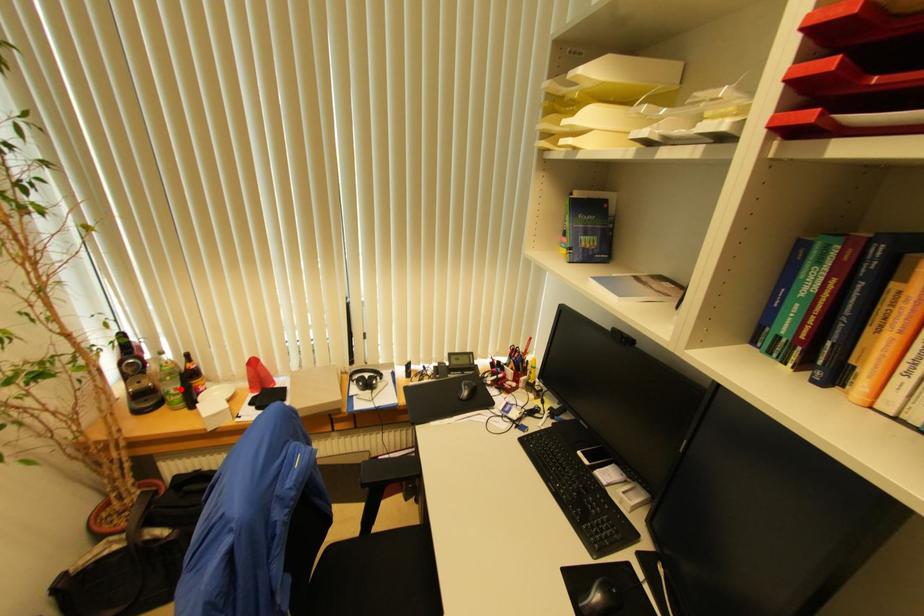
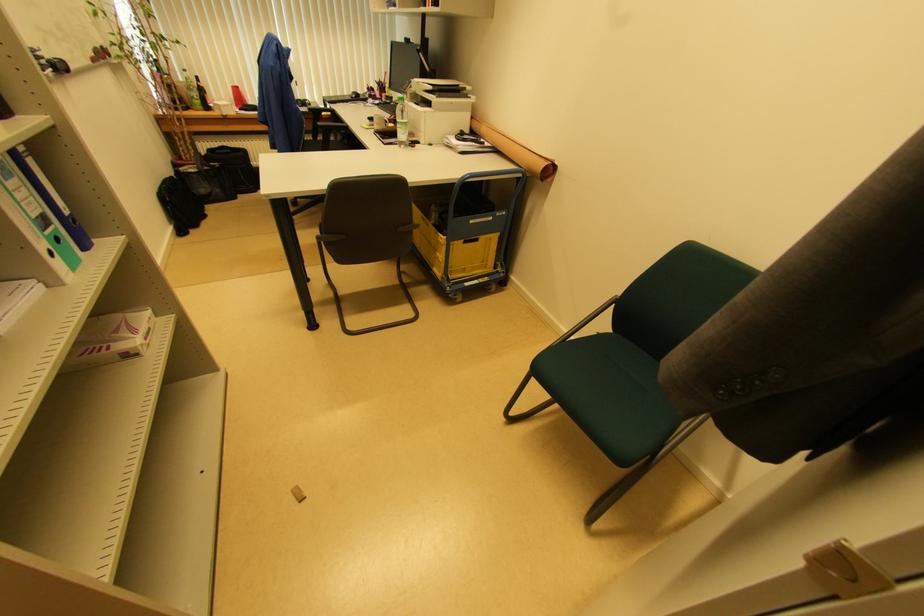
In the second image, find the point that corresponds to the highlighted location in the first image.

(200, 98)